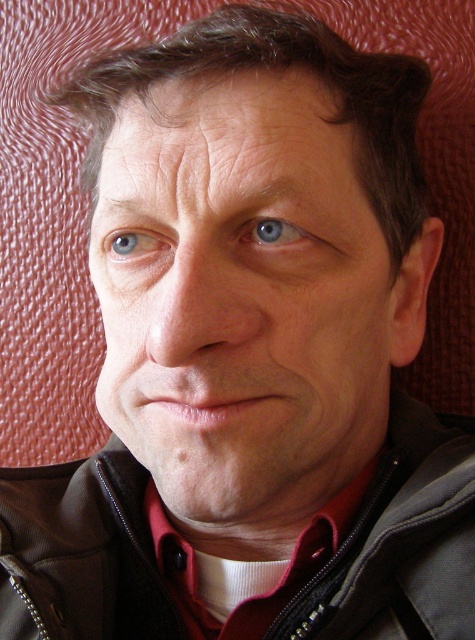
Which is behind, point (324, 572) or point (250, 234)?

The point (324, 572) is behind.

From the picture: Does dark brown leather jacket at center have a greater width compared to blue glossy eye at center?

Correct, the width of dark brown leather jacket at center exceeds that of blue glossy eye at center.

This screenshot has width=475, height=640. Find the location of `dark brown leather jacket at center`. dark brown leather jacket at center is located at coordinates (399, 544).

Who is positioned more to the left, matte black face at center or dark brown leather jacket at center?

Positioned to the left is dark brown leather jacket at center.

Is matte black face at center wider than dark brown leather jacket at center?

No.

Find the location of a particular element. matte black face at center is located at coordinates (241, 300).

Where is `matte black face at center`? Image resolution: width=475 pixels, height=640 pixels. matte black face at center is located at coordinates (241, 300).

Between blue glossy eye at center and blue matte eye at upper left, which one has more height?

blue matte eye at upper left

Who is more forward, (320, 241) or (145, 253)?

Point (320, 241) is more forward.

Is point (238, 236) positioned before point (125, 252)?

Yes, it is in front of point (125, 252).

Identify the location of blue glossy eye at center. (274, 236).